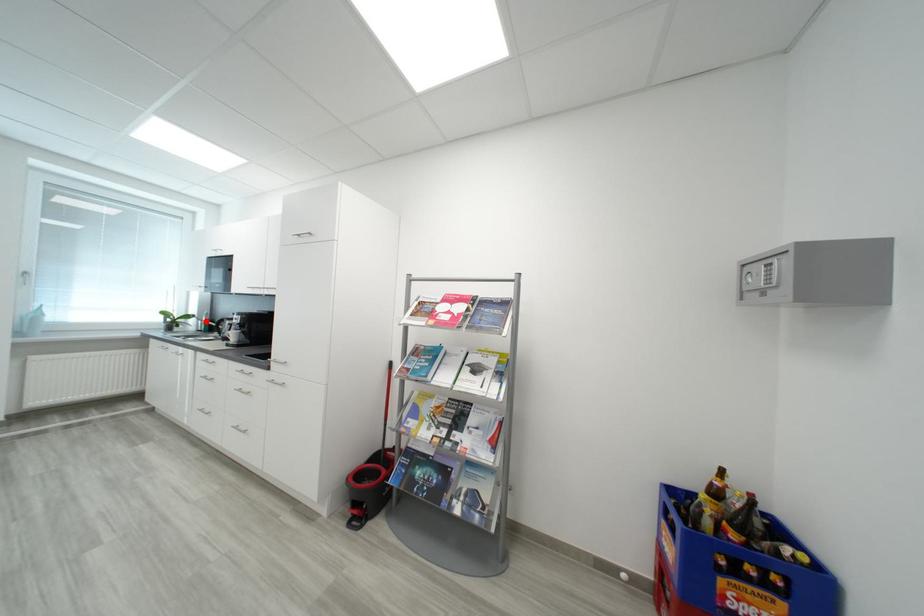
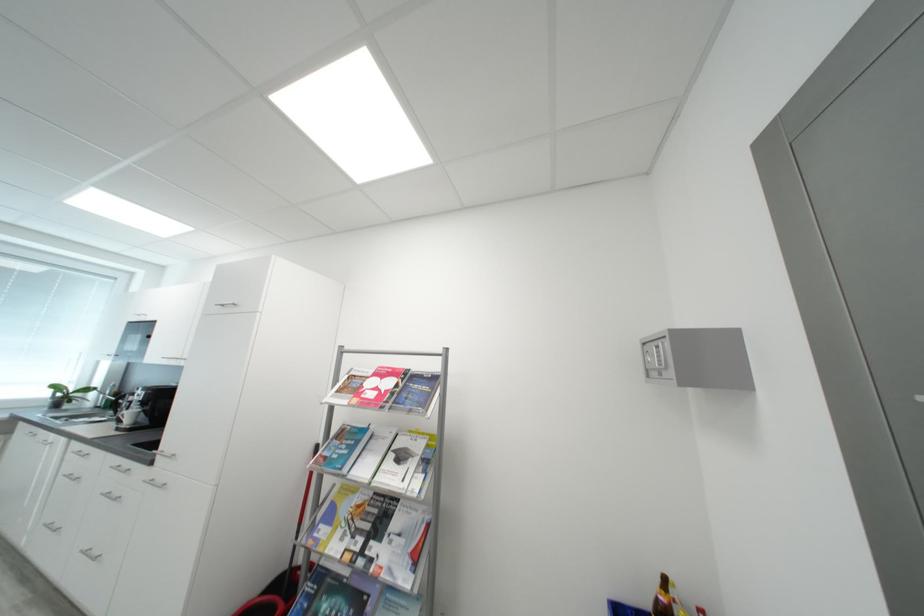
Question: I am providing you with two images of the same scene from different viewpoints. Image1 has a red point marked. In image2, the corresponding 3D location appears at what relative position? Reply with the corresponding letter.

Choices:
 (A) Closer
 (B) Farther

Answer: (A)